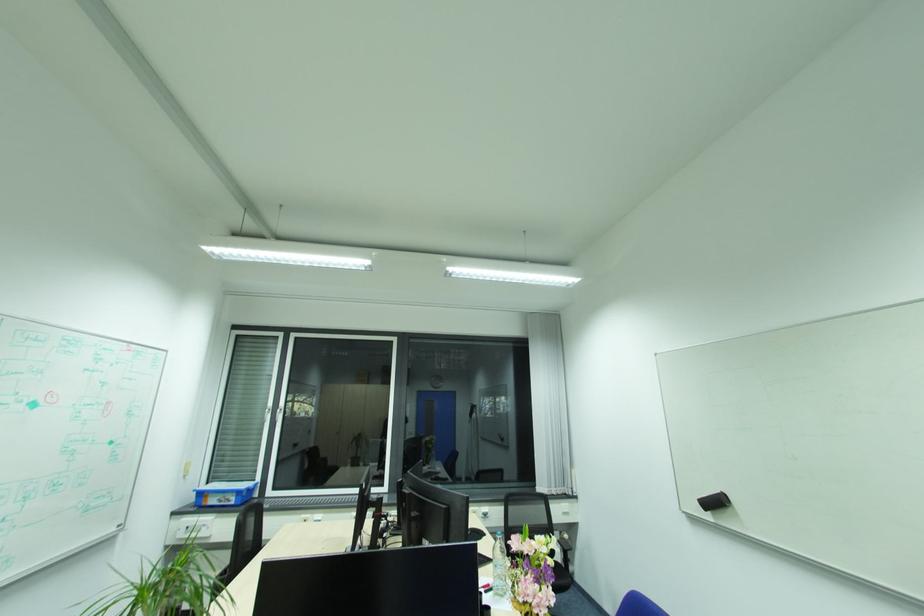
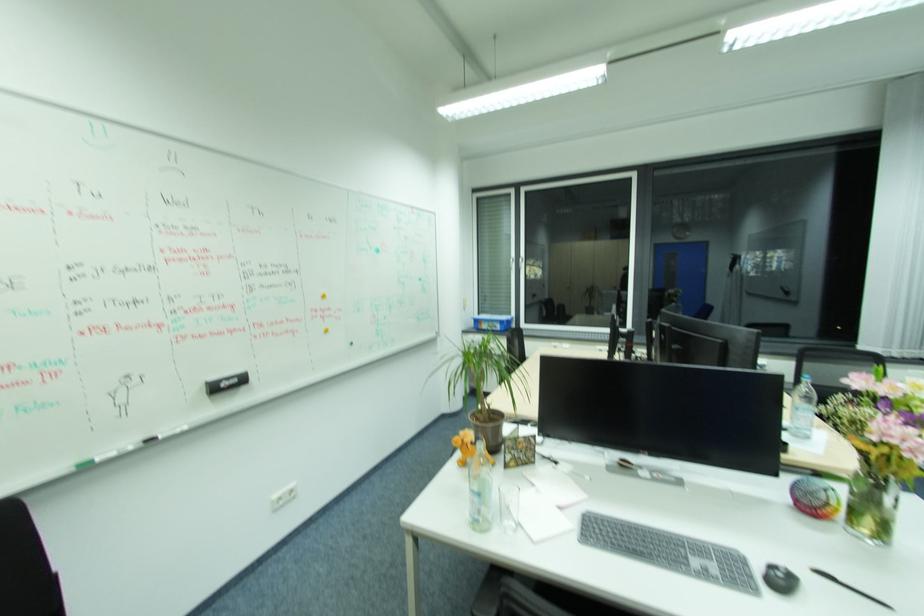
In the second image, find the point that corresponds to pixel 408 504 in the first image.

(666, 334)